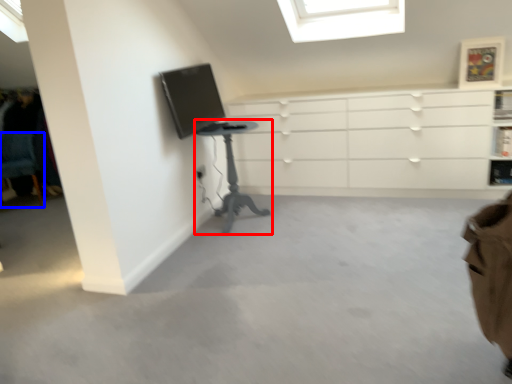
Question: Which object is closer to the camera taking this photo, table (highlighted by a red box) or computer chair (highlighted by a blue box)?

Choices:
 (A) table
 (B) computer chair

Answer: (A)